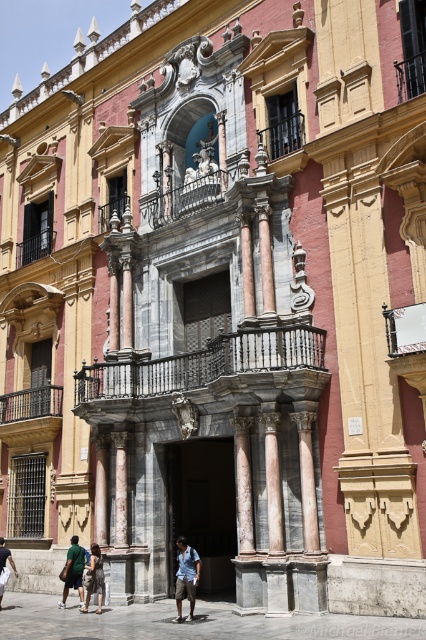
Question: Which object appears closest to the camera in this image?

Choices:
 (A) green cotton shorts at lower left
 (B) marble column at center
 (C) light brown leather pants at lower left

Answer: (B)

Question: Is marble column at center wider than light brown fabric dress at lower center?

Choices:
 (A) no
 (B) yes

Answer: (B)

Question: Is marble column at center behind green cotton shorts at lower left?

Choices:
 (A) no
 (B) yes

Answer: (A)

Question: Considering the real-world distances, which object is closest to the light brown leather pants at lower left?

Choices:
 (A) light blue denim shorts at lower center
 (B) green cotton shorts at lower left
 (C) marble column at center
 (D) light brown fabric dress at lower center

Answer: (B)

Question: Can you confirm if light blue denim shorts at lower center is positioned above light brown leather pants at lower left?

Choices:
 (A) yes
 (B) no

Answer: (A)

Question: Which is farther from the marble column at center?

Choices:
 (A) light brown fabric dress at lower center
 (B) green cotton shorts at lower left

Answer: (B)